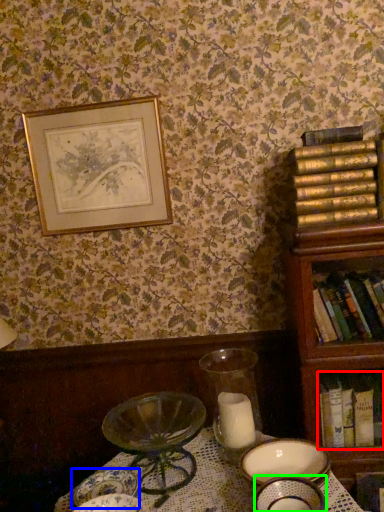
Question: Estimate the real-world distances between objects in this image. Which object is farther from book (highlighted by a red box), tableware (highlighted by a blue box) or tableware (highlighted by a green box)?

Choices:
 (A) tableware
 (B) tableware

Answer: (A)